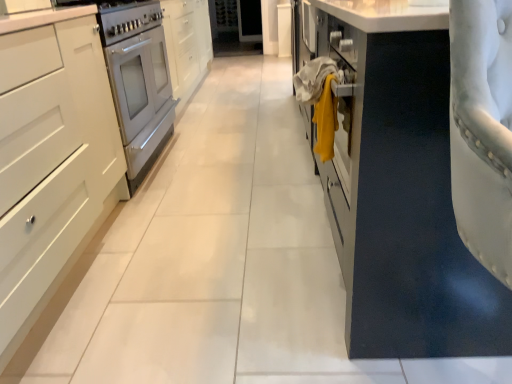
Question: Would you say white matte cabinet at left, which is the 1th cabinetry in left-to-right order, contains white glossy oven at left?

Choices:
 (A) no
 (B) yes

Answer: (A)

Question: Considering the relative sizes of white matte cabinet at left, which is the 1th cabinetry in left-to-right order, and white glossy oven at left in the image provided, is white matte cabinet at left, which is the 1th cabinetry in left-to-right order, bigger than white glossy oven at left?

Choices:
 (A) yes
 (B) no

Answer: (A)

Question: From a real-world perspective, is white matte cabinet at left, the second cabinetry viewed from the right, on top of white glossy oven at left?

Choices:
 (A) yes
 (B) no

Answer: (A)

Question: Is white matte cabinet at left, which is the 1th cabinetry in left-to-right order, taller than white glossy oven at left?

Choices:
 (A) yes
 (B) no

Answer: (A)

Question: Considering the relative sizes of white matte cabinet at left, which is the 1th cabinetry in left-to-right order, and white glossy oven at left in the image provided, is white matte cabinet at left, which is the 1th cabinetry in left-to-right order, wider than white glossy oven at left?

Choices:
 (A) no
 (B) yes

Answer: (B)

Question: Which is correct: yellow fabric at center is inside suede-like white chair at right, positioned as the second cabinetry in left-to-right order, or outside of it?

Choices:
 (A) inside
 (B) outside

Answer: (B)

Question: Does point (330, 100) appear closer or farther from the camera than point (348, 201)?

Choices:
 (A) closer
 (B) farther

Answer: (A)

Question: Is yellow fabric at center wider or thinner than suede-like white chair at right, the 1th cabinetry when ordered from right to left?

Choices:
 (A) wide
 (B) thin

Answer: (B)

Question: Would you say yellow fabric at center is to the left or to the right of suede-like white chair at right, the 1th cabinetry when ordered from right to left, in the picture?

Choices:
 (A) left
 (B) right

Answer: (A)

Question: Considering the positions of white matte cabinet at left, the second cabinetry viewed from the right, and yellow fabric at center in the image, is white matte cabinet at left, the second cabinetry viewed from the right, taller or shorter than yellow fabric at center?

Choices:
 (A) short
 (B) tall

Answer: (B)

Question: From a real-world perspective, is white matte cabinet at left, which is the 1th cabinetry in left-to-right order, physically located above or below yellow fabric at center?

Choices:
 (A) below
 (B) above

Answer: (A)

Question: Considering the relative positions of white matte cabinet at left, which is the 1th cabinetry in left-to-right order, and yellow fabric at center in the image provided, is white matte cabinet at left, which is the 1th cabinetry in left-to-right order, to the left or to the right of yellow fabric at center?

Choices:
 (A) right
 (B) left

Answer: (B)

Question: Considering the positions of white matte cabinet at left, the second cabinetry viewed from the right, and yellow fabric at center in the image, is white matte cabinet at left, the second cabinetry viewed from the right, wider or thinner than yellow fabric at center?

Choices:
 (A) wide
 (B) thin

Answer: (A)

Question: Is white glossy oven at left in front of or behind white matte cabinet at left, the second cabinetry viewed from the right, in the image?

Choices:
 (A) front
 (B) behind

Answer: (B)

Question: Considering the positions of white glossy oven at left and white matte cabinet at left, which is the 1th cabinetry in left-to-right order, in the image, is white glossy oven at left taller or shorter than white matte cabinet at left, which is the 1th cabinetry in left-to-right order,?

Choices:
 (A) tall
 (B) short

Answer: (B)